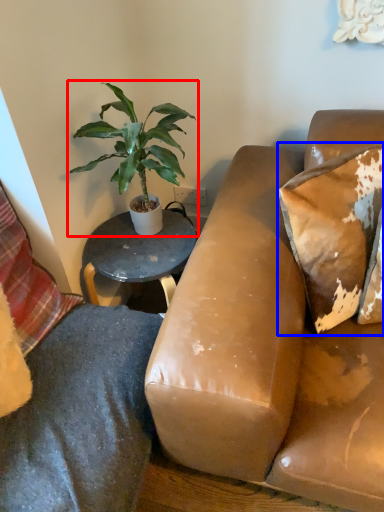
Question: Among these objects, which one is nearest to the camera, houseplant (highlighted by a red box) or pillow (highlighted by a blue box)?

Choices:
 (A) houseplant
 (B) pillow

Answer: (B)